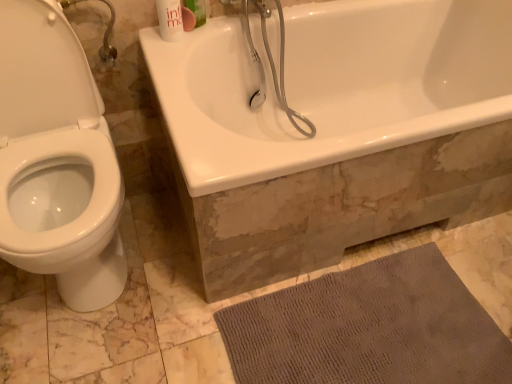
Question: From their relative heights in the image, would you say white glossy bathtub at upper center is taller or shorter than white glossy mouthwash at upper center, which is counted as the first mouthwash, starting from the right?

Choices:
 (A) tall
 (B) short

Answer: (A)

Question: Based on their sizes in the image, would you say white glossy bathtub at upper center is bigger or smaller than white glossy mouthwash at upper center, which is counted as the first mouthwash, starting from the right?

Choices:
 (A) small
 (B) big

Answer: (B)

Question: Which of these objects is positioned farthest from the white glossy mouthwash at upper center, the first mouthwash when ordered from left to right?

Choices:
 (A) white glossy mouthwash at upper center, which is counted as the first mouthwash, starting from the right
 (B) gray textured bath mat at lower right
 (C) white glossy bathtub at upper center

Answer: (B)

Question: Which of these objects is positioned farthest from the gray textured bath mat at lower right?

Choices:
 (A) white glossy mouthwash at upper center, the 2th mouthwash positioned from the right
 (B) white glossy bathtub at upper center
 (C) white glossy mouthwash at upper center, which is counted as the first mouthwash, starting from the right

Answer: (C)